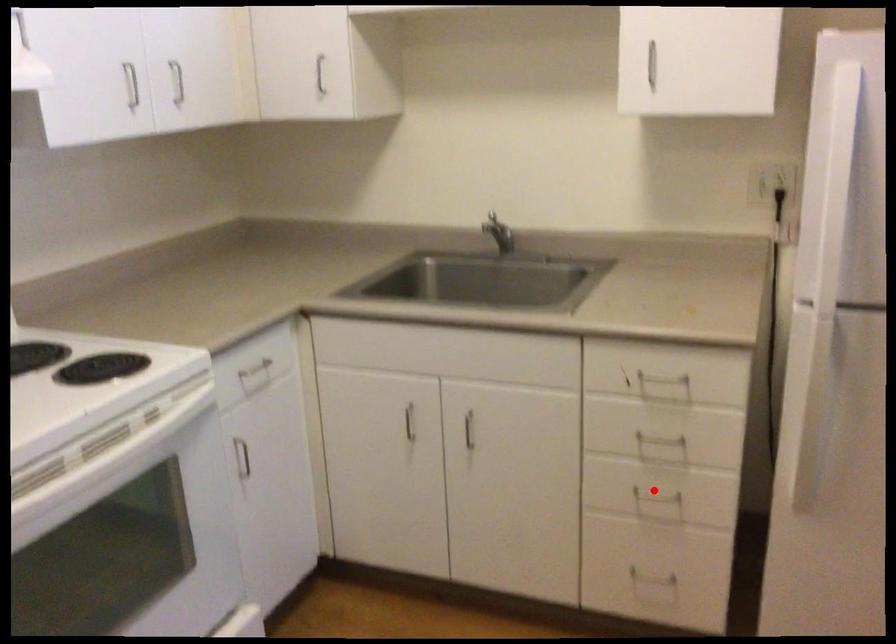
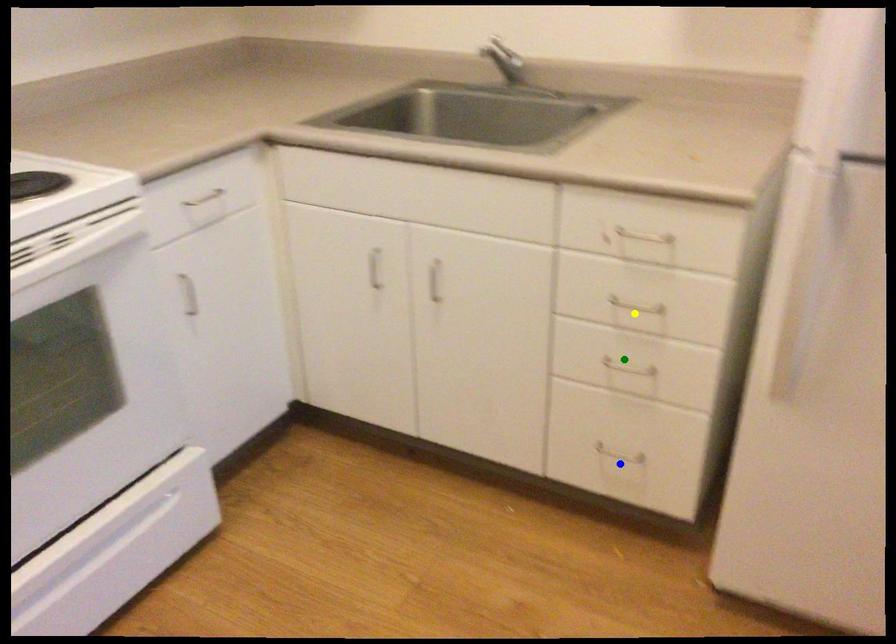
Question: I am providing you with two images of the same scene from different viewpoints. A red point is marked on the first image. You are given multiple points on the second image. Which point in image 2 represents the same 3d spot as the red point in image 1?

Choices:
 (A) green point
 (B) yellow point
 (C) blue point

Answer: (A)